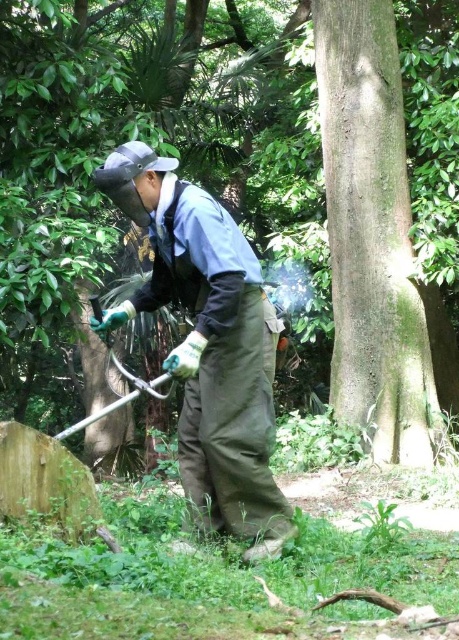
Based on the photo, between smooth brown tree trunk at right and green fabric apron at center, which one is positioned higher?

smooth brown tree trunk at right is above.

Which is in front, point (345, 253) or point (158, 182)?

Positioned in front is point (158, 182).

Is point (329, 134) positioned before point (261, 305)?

No, (329, 134) is further to viewer.

Locate an element on the screen. Image resolution: width=459 pixels, height=640 pixels. smooth brown tree trunk at right is located at coordinates (371, 236).

Which is above, green matte grass at lower center or green fabric apron at center?

Positioned higher is green matte grass at lower center.

Between green matte grass at lower center and green fabric apron at center, which one is positioned lower?

green fabric apron at center

This screenshot has width=459, height=640. What are the coordinates of `green matte grass at lower center` in the screenshot? It's located at (139, 131).

Between point (139, 120) and point (388, 339), which one is positioned in front?

Point (388, 339) is more forward.

Which is more to the right, green matte grass at lower center or smooth brown tree trunk at right?

From the viewer's perspective, smooth brown tree trunk at right appears more on the right side.

What do you see at coordinates (139, 131) in the screenshot?
I see `green matte grass at lower center` at bounding box center [139, 131].

This screenshot has width=459, height=640. Identify the location of green matte grass at lower center. (139, 131).